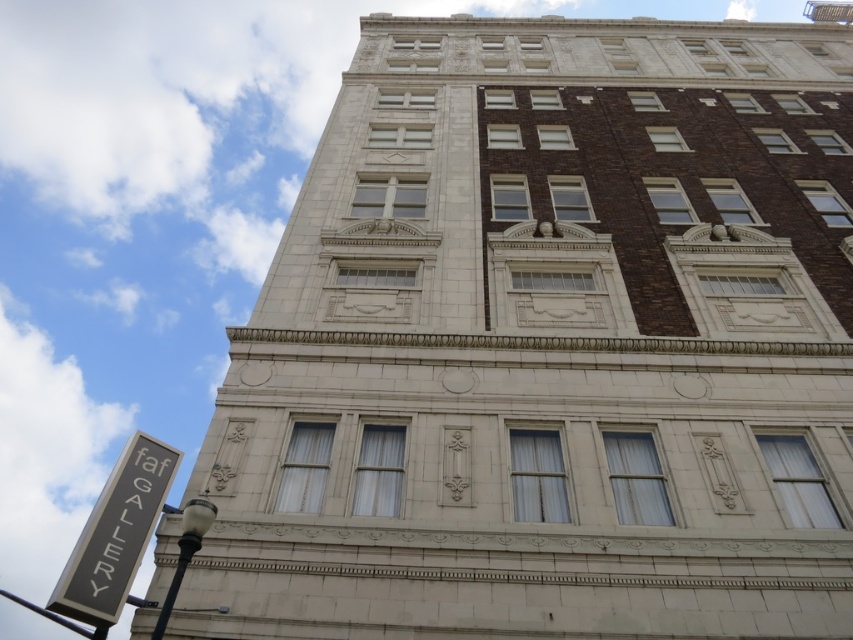
This screenshot has width=853, height=640. I want to click on black metal sign at lower left, so click(x=115, y=534).

Which is behind, point (144, 481) or point (33, 609)?

The point (33, 609) is more distant.

At what (x,y) coordinates should I click in order to perform the action: click on black metal sign at lower left. Please return your answer as a coordinate pair (x, y). Looking at the image, I should click on (115, 534).

At what (x,y) coordinates should I click in order to perform the action: click on black metal sign at lower left. Please return your answer as a coordinate pair (x, y). The image size is (853, 640). Looking at the image, I should click on (115, 534).